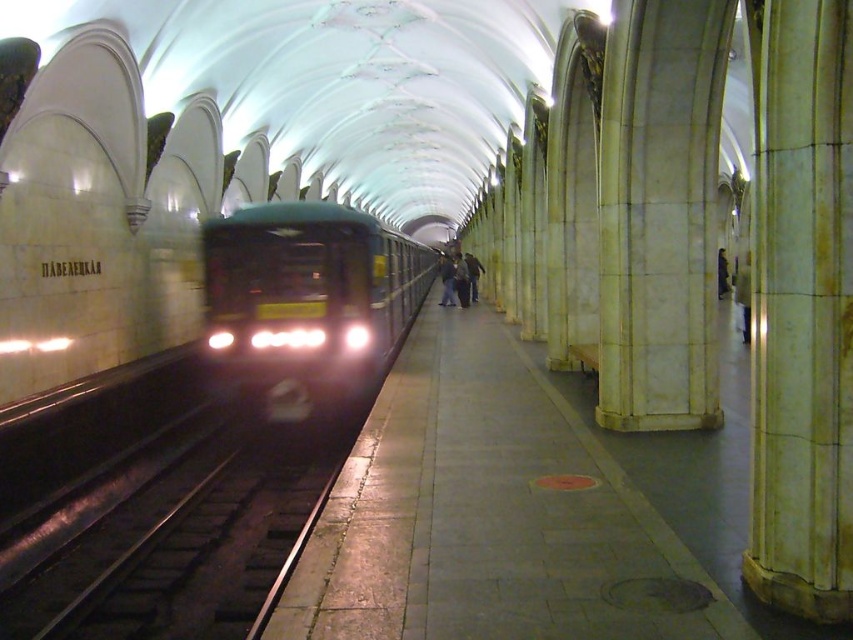
You are a passenger waiting at the subway station and want to board the dark green metallic train at center. There is a white marble pillar at right blocking your path. Can you walk around it to reach the train?

The white marble pillar at right is to the right of the dark green metallic train at center, so you can walk around the pillar to the left side to reach the train.

You are standing at the subway station and want to quickly reach the white marble pillar at right before the train arrives. The train is approaching from the left side. Is the pillar close enough for you to reach safely before the train gets here?

The white marble pillar at right is 12.82 feet from the viewer. Since the train is approaching from the left, you would need to move towards the pillar to your right. However, without knowing the train speed and your running speed, it is impossible to determine if you can reach it safely before the train arrives.

You are a passenger waiting at the subway station. You notice the white marble pillar at right and the dark green metallic train at center. Which object is shorter in height?

The white marble pillar at right is shorter in height than the dark green metallic train at center.